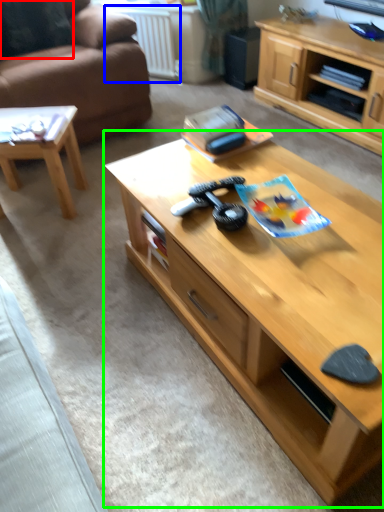
Question: Considering the real-world distances, which object is farthest from pillow (highlighted by a red box)? radiator (highlighted by a blue box) or coffee table (highlighted by a green box)?

Choices:
 (A) radiator
 (B) coffee table

Answer: (B)